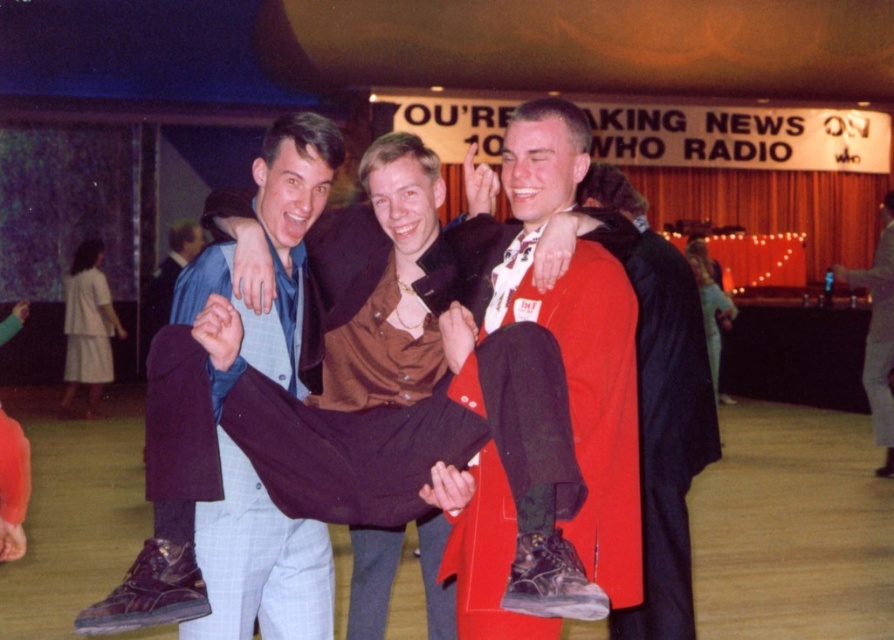
You are standing in the room and want to hand a gift to the person wearing the light blue plaid pants at center and the brown leather jacket at center. Which one can you reach first without moving closer?

The light blue plaid pants at center is closer to the viewer than the brown leather jacket at center, so you can reach the person wearing the light blue plaid pants at center first without moving closer.

You are standing at the entrance of the room and want to find the light blue plaid pants at center. According to the scene description, where should you look relative to the central area of the room?

The light blue plaid pants at center is located at point 0.400 on the x axis and 0.301 on the y axis, so you should look slightly to the right and slightly below the central point of the room.